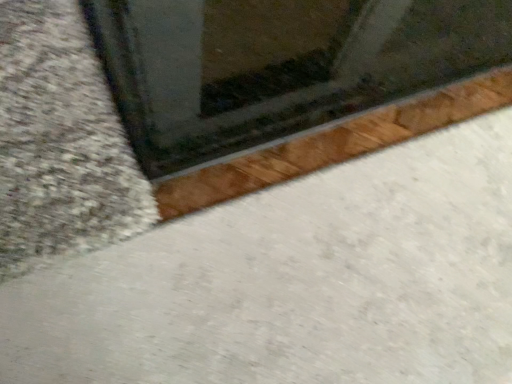
Question: Is white smooth concrete at lower left bigger or smaller than transparent glass window at upper center?

Choices:
 (A) big
 (B) small

Answer: (B)

Question: Is white smooth concrete at lower left wider or thinner than transparent glass window at upper center?

Choices:
 (A) thin
 (B) wide

Answer: (B)

Question: From the image's perspective, is white smooth concrete at lower left located above or below transparent glass window at upper center?

Choices:
 (A) above
 (B) below

Answer: (B)

Question: Looking at the image, does transparent glass window at upper center seem bigger or smaller compared to white smooth concrete at lower left?

Choices:
 (A) big
 (B) small

Answer: (A)

Question: Is transparent glass window at upper center spatially inside white smooth concrete at lower left, or outside of it?

Choices:
 (A) outside
 (B) inside

Answer: (A)

Question: Is transparent glass window at upper center wider or thinner than white smooth concrete at lower left?

Choices:
 (A) wide
 (B) thin

Answer: (B)

Question: From the image's perspective, relative to white smooth concrete at lower left, is transparent glass window at upper center above or below?

Choices:
 (A) below
 (B) above

Answer: (B)